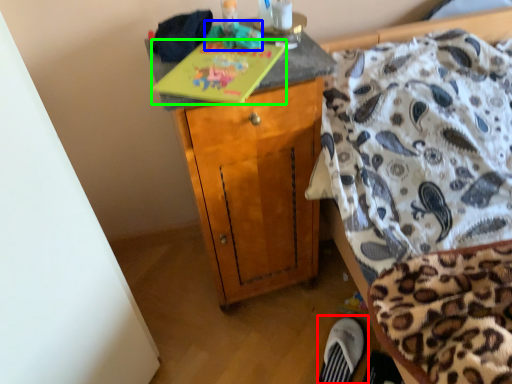
Question: Considering the real-world distances, which object is farthest from footwear (highlighted by a red box)? toy (highlighted by a blue box) or book (highlighted by a green box)?

Choices:
 (A) toy
 (B) book

Answer: (A)